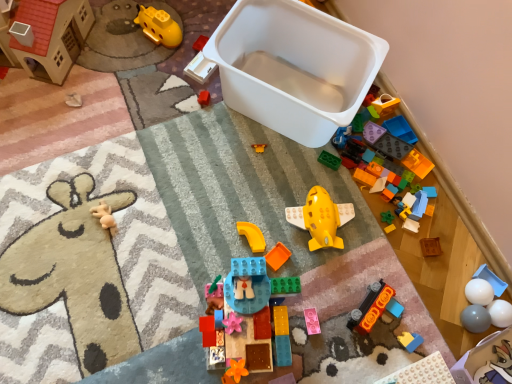
Locate an element on the screen. The height and width of the screenshot is (384, 512). free area in between beige rubber bear at left, which ranks as the 15th toy in right-to-left order, and yellow matte airplane at center, the ninth toy from the right is located at coordinates (208, 224).